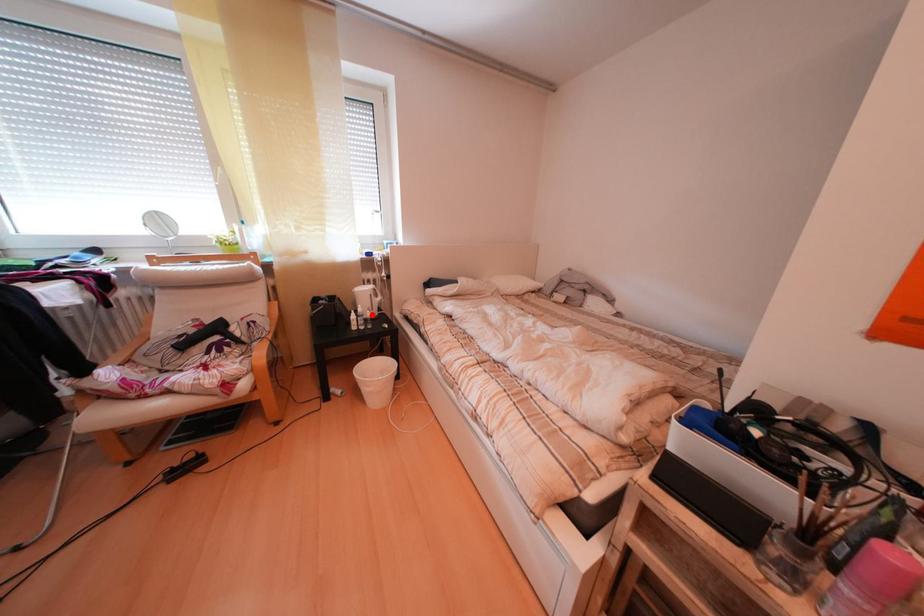
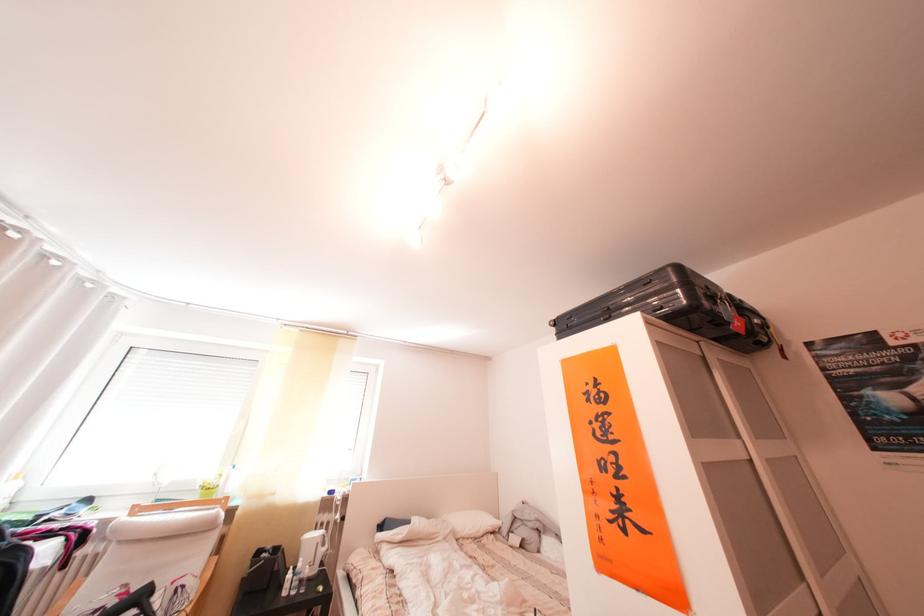
Question: I am providing you with two images of the same scene from different viewpoints. Image1 has a red point marked. In image2, the corresponding 3D location appears at what relative position? Reply with the corresponding letter.

Choices:
 (A) Closer
 (B) Farther

Answer: (B)